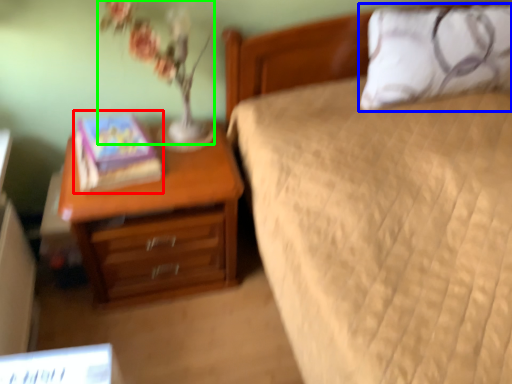
Question: Which is nearer to the book (highlighted by a red box)? pillow (highlighted by a blue box) or floral arrangement (highlighted by a green box).

Choices:
 (A) pillow
 (B) floral arrangement

Answer: (B)